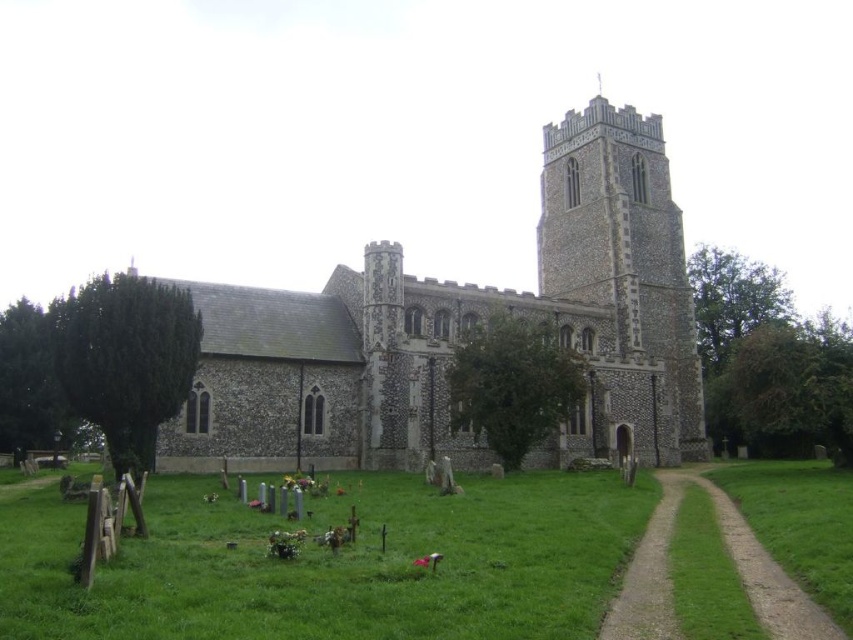
Is point (612, 428) positioned in front of point (680, 376)?

That is True.

Measure the distance from stone church at center to stone tower at center.

4.34 meters

Does point (282, 291) come closer to viewer compared to point (570, 228)?

Yes, point (282, 291) is in front of point (570, 228).

Find the location of a particular element. The image size is (853, 640). stone church at center is located at coordinates (460, 332).

Is stone church at center smaller than green grassy path at lower right?

No, stone church at center is not smaller than green grassy path at lower right.

Does stone church at center lie behind green grassy path at lower right?

That is True.

You are a GUI agent. You are given a task and a screenshot of the screen. Output one action in this format:
    pyautogui.click(x=<x>, y=<y>)
    Task: Click on the stone church at center
    The image size is (853, 640).
    Given the screenshot: What is the action you would take?
    pyautogui.click(x=460, y=332)

Is point (668, 220) behind point (766, 566)?

Yes.

Does stone tower at center appear on the left side of green grassy path at lower right?

In fact, stone tower at center is to the right of green grassy path at lower right.

Which is in front, point (595, 218) or point (756, 540)?

Point (756, 540)

Locate an element on the screen. This screenshot has width=853, height=640. stone tower at center is located at coordinates (624, 272).